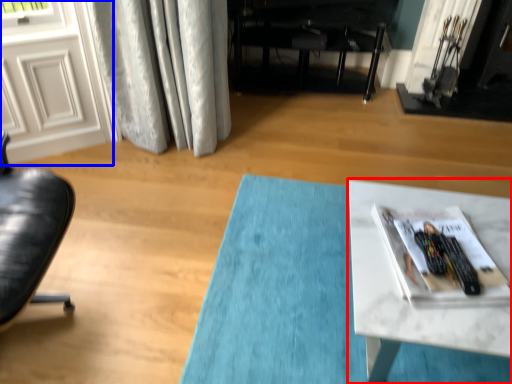
Question: Which point is closer to the camera, table (highlighted by a red box) or screen door (highlighted by a blue box)?

Choices:
 (A) table
 (B) screen door

Answer: (A)